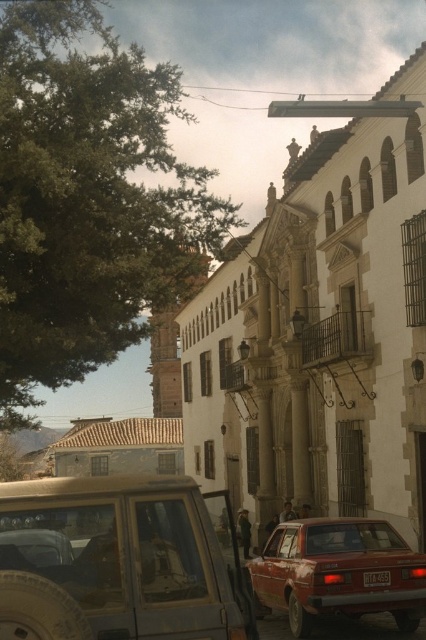
Question: Does metallic silver suv at center appear on the left side of metallic red license plate at center?

Choices:
 (A) no
 (B) yes

Answer: (B)

Question: Based on their relative distances, which object is nearer to the metallic silver suv at center?

Choices:
 (A) metallic red license plate at center
 (B) matte red sedan at lower right

Answer: (A)

Question: Where is metallic silver suv at center located in relation to metallic red license plate at center in the image?

Choices:
 (A) above
 (B) below

Answer: (A)

Question: Estimate the real-world distances between objects in this image. Which object is farther from the metallic red license plate at center?

Choices:
 (A) matte red sedan at lower right
 (B) metallic silver suv at center

Answer: (B)

Question: Is metallic silver suv at center below matte red sedan at lower right?

Choices:
 (A) yes
 (B) no

Answer: (B)

Question: Which object is the farthest from the metallic red license plate at center?

Choices:
 (A) matte red sedan at lower right
 (B) metallic silver suv at center

Answer: (B)